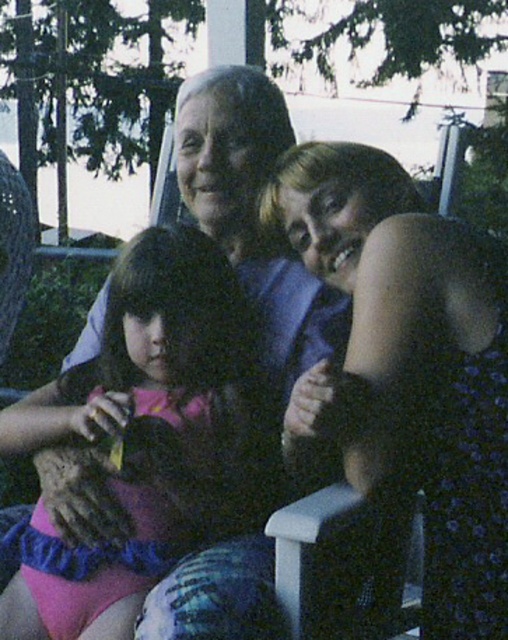
Question: Can you confirm if matte blue dress at center is thinner than pink fabric dress at center?

Choices:
 (A) yes
 (B) no

Answer: (A)

Question: Is matte blue dress at center positioned behind pink fabric dress at center?

Choices:
 (A) no
 (B) yes

Answer: (A)

Question: Is matte blue dress at center smaller than pink fabric dress at center?

Choices:
 (A) yes
 (B) no

Answer: (A)

Question: Which point is farther to the camera?

Choices:
 (A) (495, 268)
 (B) (143, 252)

Answer: (B)

Question: Which point is closer to the camera taking this photo?

Choices:
 (A) (166, 429)
 (B) (462, 420)

Answer: (B)